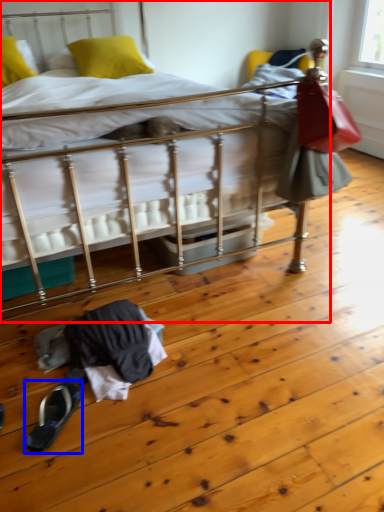
Question: Which object is closer to the camera taking this photo, bed (highlighted by a red box) or footwear (highlighted by a blue box)?

Choices:
 (A) bed
 (B) footwear

Answer: (A)